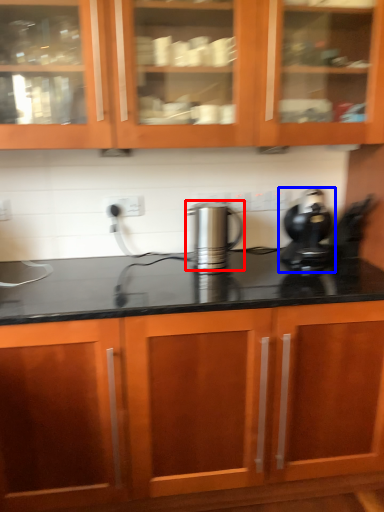
Question: Which object is closer to the camera taking this photo, kitchen appliance (highlighted by a red box) or home appliance (highlighted by a blue box)?

Choices:
 (A) kitchen appliance
 (B) home appliance

Answer: (B)